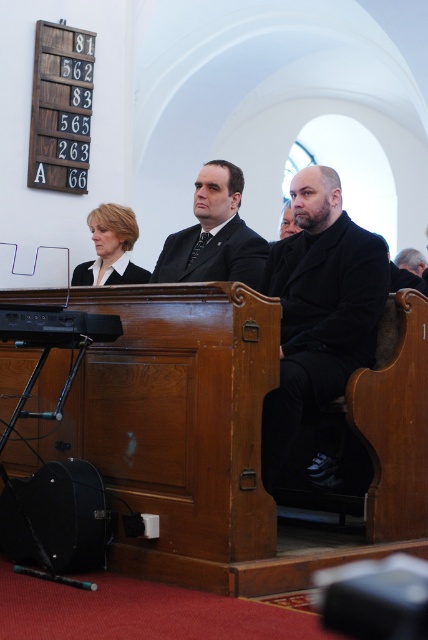
Question: Among these objects, which one is nearest to the camera?

Choices:
 (A) matte black suit at center
 (B) black matte business suit at center
 (C) black matte coat at center

Answer: (C)

Question: Which object is the farthest from the black matte business suit at center?

Choices:
 (A) black matte suit at center
 (B) black matte coat at center

Answer: (B)

Question: Does black matte coat at center have a smaller size compared to black matte suit at center?

Choices:
 (A) yes
 (B) no

Answer: (B)

Question: Can you confirm if black matte suit at center is positioned below matte black suit at center?

Choices:
 (A) no
 (B) yes

Answer: (A)

Question: Which point is closer to the camera taking this photo?

Choices:
 (A) (326, 196)
 (B) (107, 268)
 (C) (118, 212)
 (D) (234, 182)

Answer: (A)

Question: Can you confirm if black matte suit at center is thinner than matte black suit at center?

Choices:
 (A) no
 (B) yes

Answer: (A)